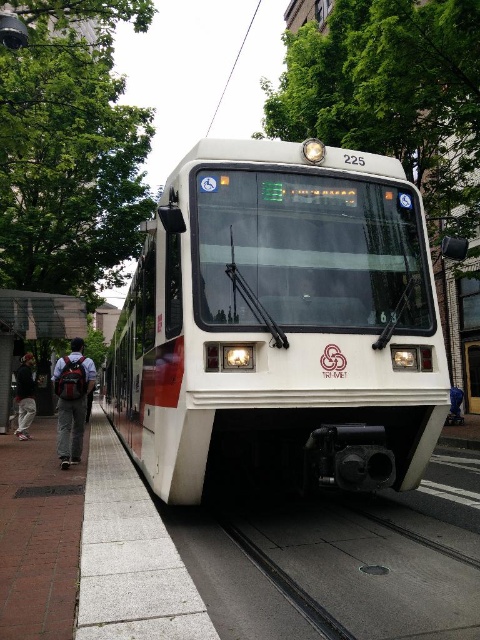
Question: Which point is closer to the camera?

Choices:
 (A) (31, 369)
 (B) (62, 397)

Answer: (B)

Question: Does black rubber train track at center appear under dark gray backpack at left?

Choices:
 (A) yes
 (B) no

Answer: (A)

Question: Among these objects, which one is farthest from the camera?

Choices:
 (A) dark gray backpack at left
 (B) white glossy train at center

Answer: (A)

Question: Which point is farther from the camera taking this photo?

Choices:
 (A) (81, 369)
 (B) (25, 365)
 (C) (118, 410)

Answer: (C)

Question: Observing the image, what is the correct spatial positioning of white glossy train at center in reference to black rubber train track at center?

Choices:
 (A) left
 (B) right

Answer: (B)

Question: Can you confirm if black rubber train track at center is positioned above dark gray backpack at left?

Choices:
 (A) yes
 (B) no

Answer: (B)